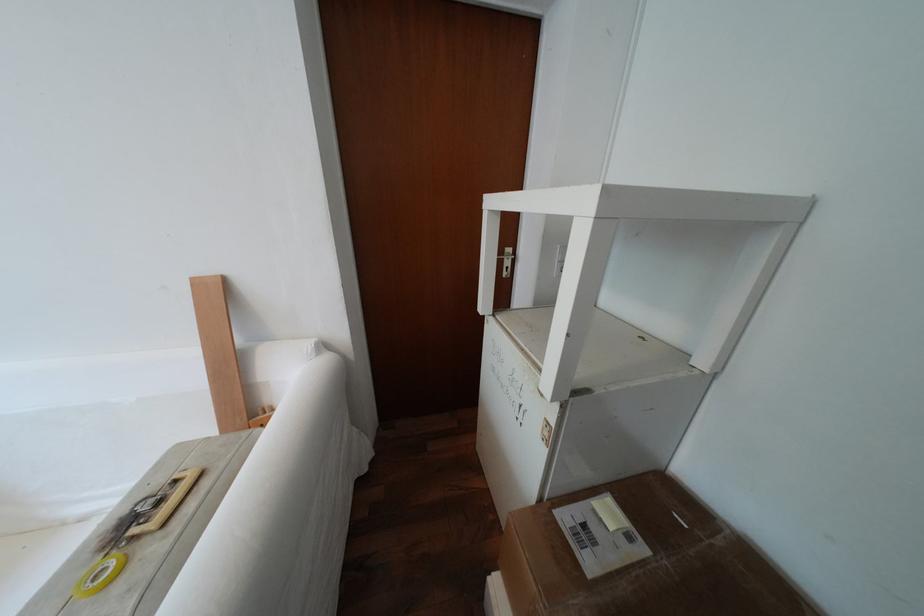
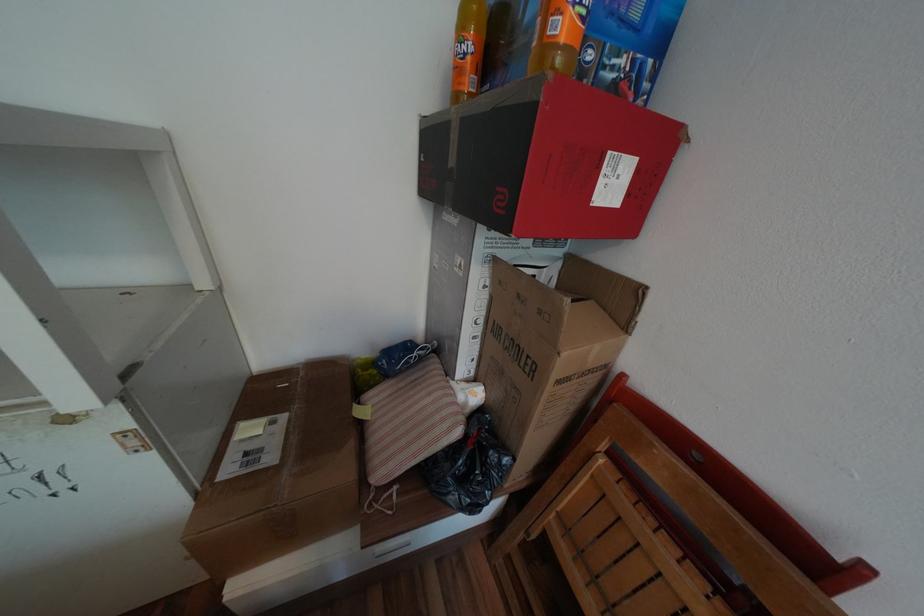
Where in the second image is the point corresponding to (651,549) from the first image?

(293, 416)